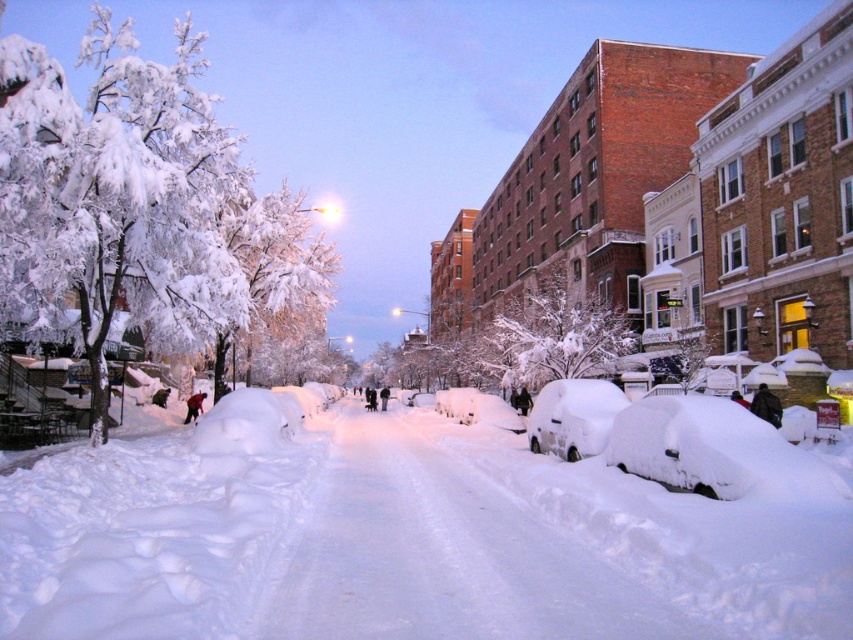
Question: Based on their relative distances, which object is farther from the white fluffy car at center?

Choices:
 (A) white fluffy snow at center
 (B) white frosty tree at center
 (C) snow-covered car at lower right
 (D) white frosty tree at upper center

Answer: (D)

Question: Can you confirm if snow-covered car at lower right is bigger than white fluffy car at center?

Choices:
 (A) no
 (B) yes

Answer: (B)

Question: Based on their relative distances, which object is nearer to the snow-covered car at lower right?

Choices:
 (A) white fluffy snow at center
 (B) white fluffy car at center

Answer: (A)

Question: Which object appears closest to the camera in this image?

Choices:
 (A) white frosty tree at center
 (B) white frosty tree at upper center
 (C) white fluffy car at center

Answer: (C)

Question: Is white fluffy snow at center below white fluffy car at center?

Choices:
 (A) yes
 (B) no

Answer: (A)

Question: Is white frosty tree at upper center to the right of white fluffy car at center from the viewer's perspective?

Choices:
 (A) no
 (B) yes

Answer: (A)